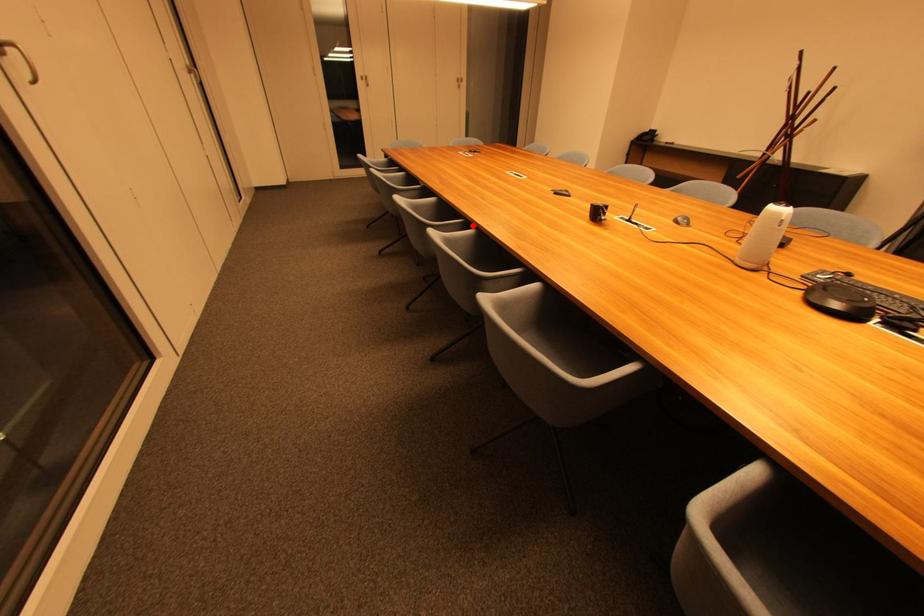
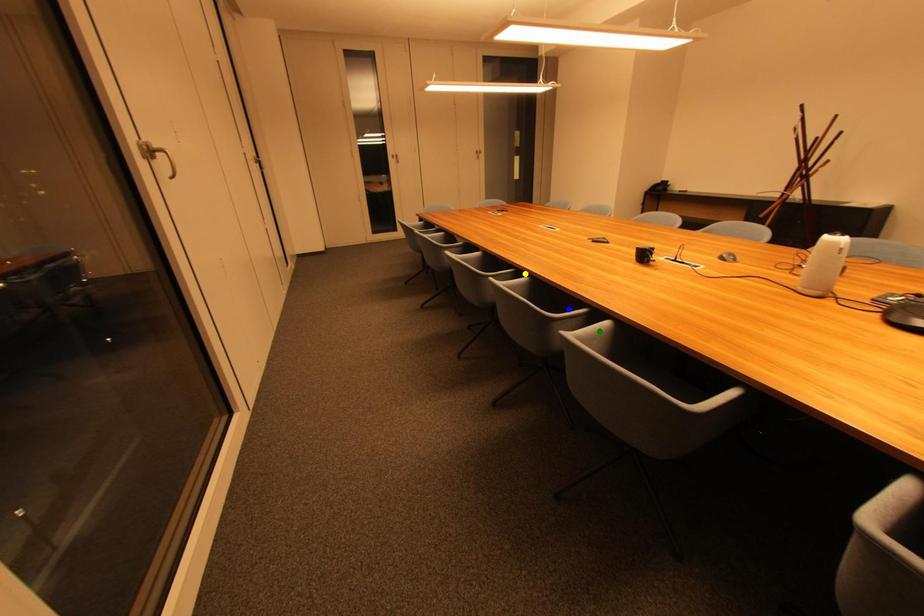
Question: I am providing you with two images of the same scene from different viewpoints. A red point is marked on the first image. You are given multiple points on the second image. In image 2, which mark is for the same physical point as the one in image 1?

Choices:
 (A) blue point
 (B) green point
 (C) yellow point

Answer: (C)